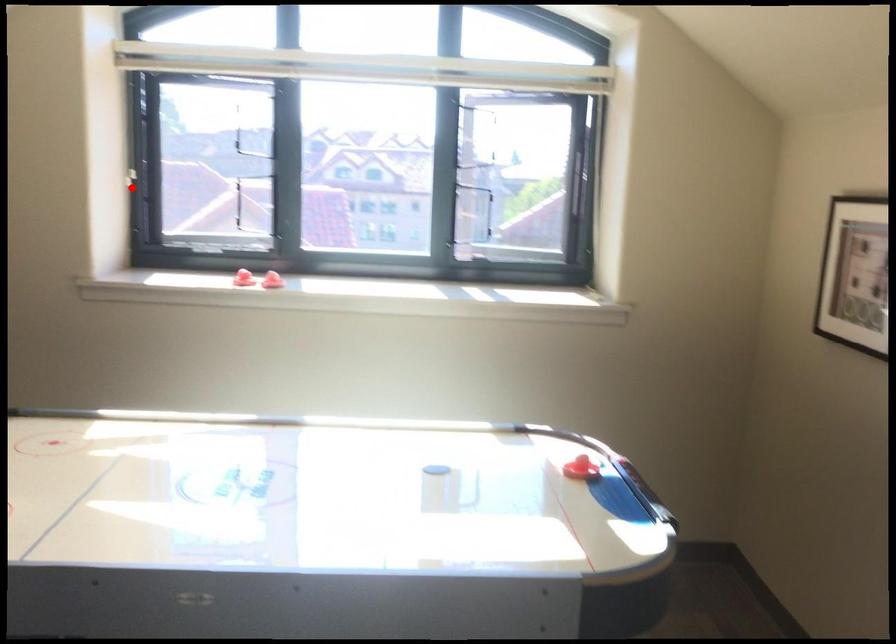
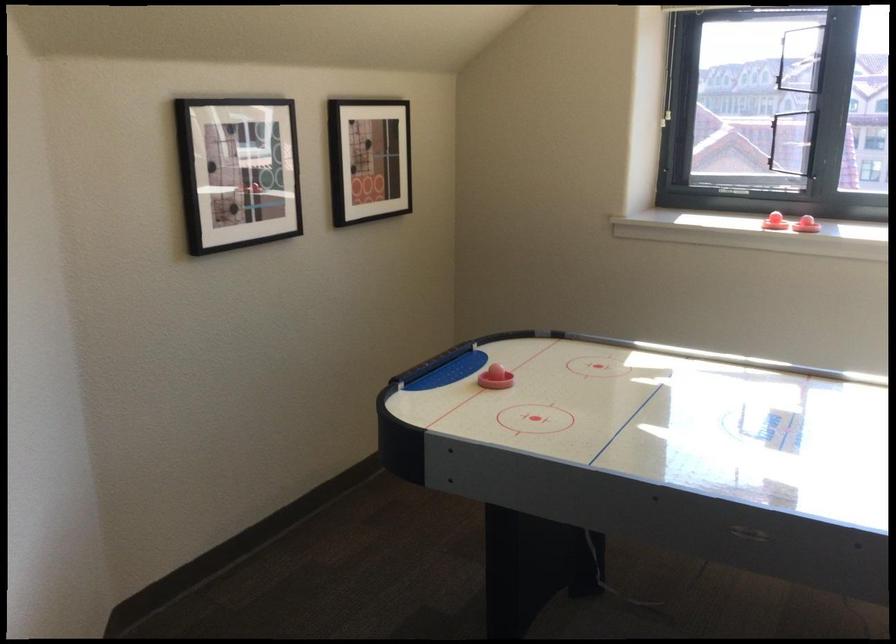
Question: I am providing you with two images of the same scene from different viewpoints. A red point is marked on the first image. At the location where the point appears in image 1, is it still visible in image 2?

Choices:
 (A) Yes
 (B) No

Answer: (A)